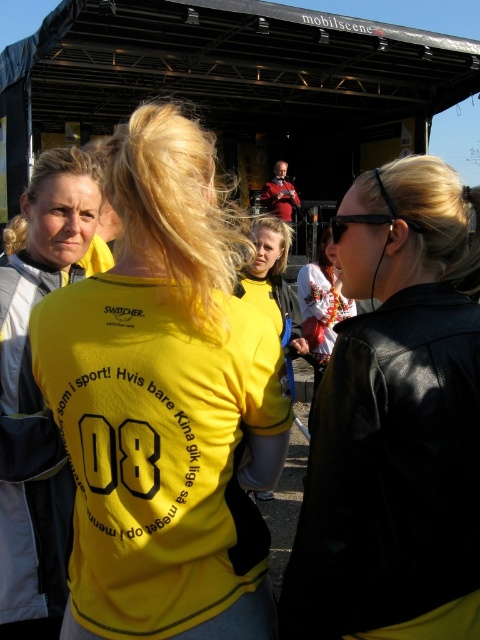
Question: Which is farther from the black plastic goggles at upper center?

Choices:
 (A) black leather jacket at upper right
 (B) yellow matte shirt at center
 (C) yellow matte shirt at left
 (D) yellow fabric shirt at center

Answer: (D)

Question: Is yellow matte shirt at center bigger than black leather jacket at upper right?

Choices:
 (A) no
 (B) yes

Answer: (B)

Question: Based on their relative distances, which object is nearer to the black leather jacket at upper right?

Choices:
 (A) yellow matte shirt at left
 (B) black plastic goggles at upper center
 (C) yellow matte shirt at center

Answer: (C)

Question: Does black leather jacket at upper right come in front of yellow matte shirt at left?

Choices:
 (A) yes
 (B) no

Answer: (A)

Question: Which of these objects is positioned closest to the yellow fabric shirt at center?

Choices:
 (A) yellow matte shirt at center
 (B) black plastic goggles at upper center
 (C) yellow matte shirt at left

Answer: (C)

Question: Is yellow matte shirt at center thinner than yellow fabric shirt at center?

Choices:
 (A) yes
 (B) no

Answer: (B)